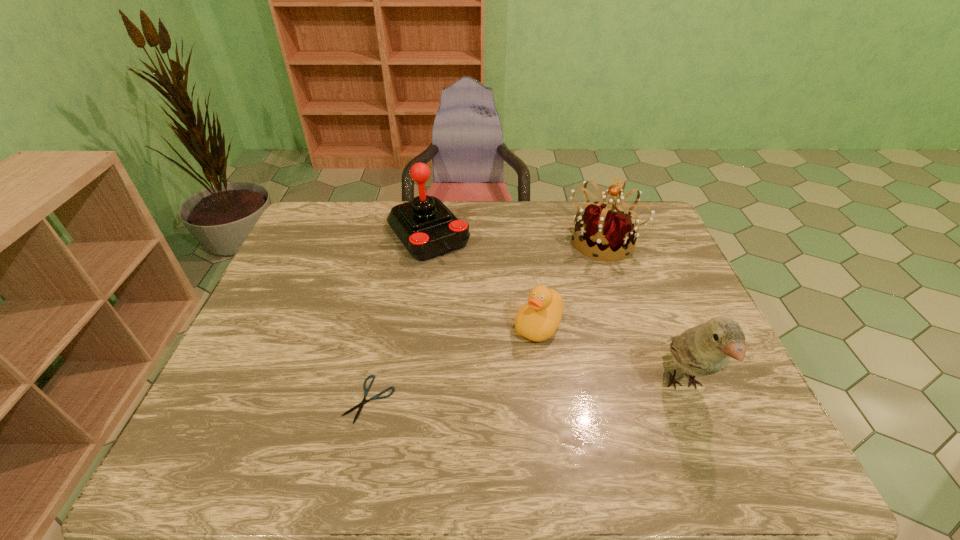
The height and width of the screenshot is (540, 960). Identify the location of vacant space on the desktop that is between the shortest object and the bird and is positioned on the face of the duck. (489, 394).

The height and width of the screenshot is (540, 960). Find the location of `free spot on the desktop that is between the shortest object and the bird and is positioned on the base of the joystick`. free spot on the desktop that is between the shortest object and the bird and is positioned on the base of the joystick is located at coordinates (553, 390).

Locate an element on the screen. This screenshot has width=960, height=540. vacant spot on the desktop that is between the shears and the bird and is positioned on the front-facing side of the tiara is located at coordinates (515, 392).